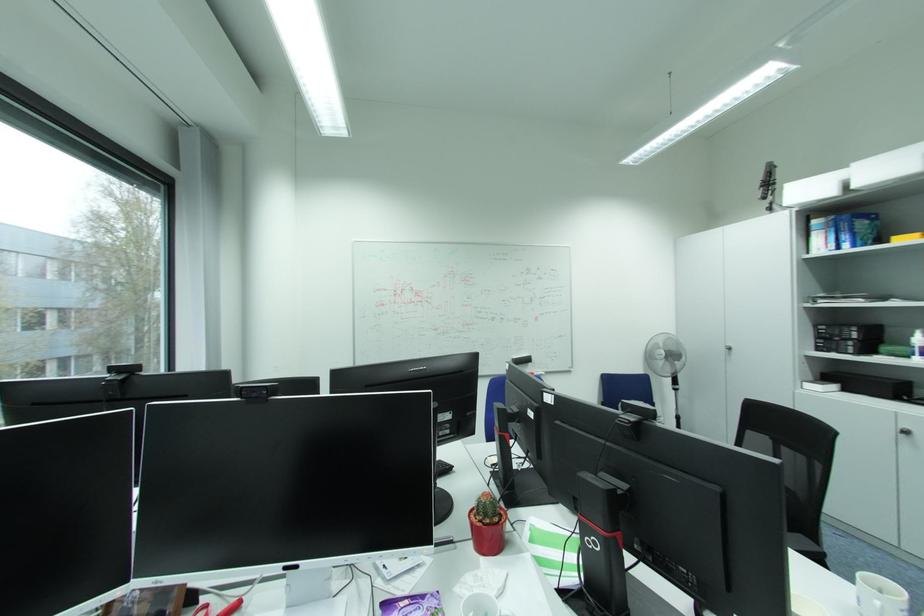
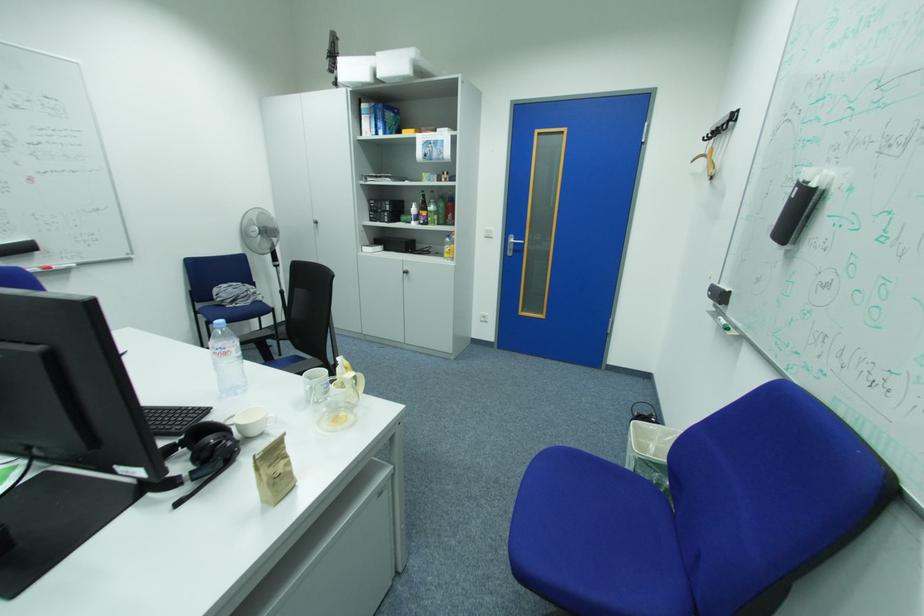
Where in the second image is the point corresponding to the point at 541,299 from the first image?

(14, 140)